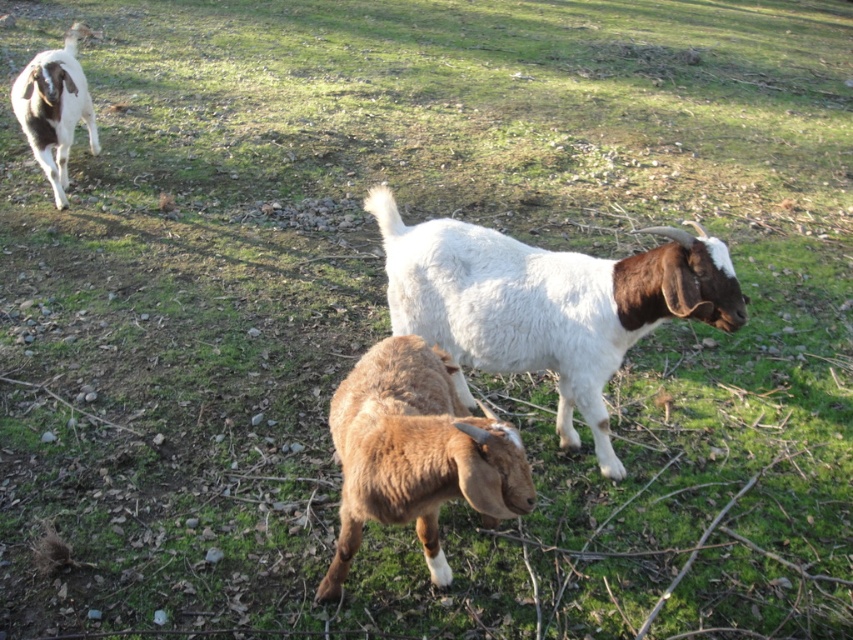
Is white woolen goat at center taller than brown fuzzy goat at center?

Correct, white woolen goat at center is much taller as brown fuzzy goat at center.

Is white woolen goat at center positioned in front of brown fuzzy goat at center?

No.

The height and width of the screenshot is (640, 853). I want to click on white woolen goat at center, so click(x=548, y=304).

Can you confirm if brown fuzzy goat at center is positioned above brown woolen goat at upper left?

No.

Between brown fuzzy goat at center and brown woolen goat at upper left, which one appears on the right side from the viewer's perspective?

Positioned to the right is brown fuzzy goat at center.

You are a GUI agent. You are given a task and a screenshot of the screen. Output one action in this format:
    pyautogui.click(x=<x>, y=<y>)
    Task: Click on the brown fuzzy goat at center
    The image size is (853, 640).
    Given the screenshot: What is the action you would take?
    pyautogui.click(x=416, y=452)

The height and width of the screenshot is (640, 853). Describe the element at coordinates (548, 304) in the screenshot. I see `white woolen goat at center` at that location.

Is white woolen goat at center taller than brown woolen goat at upper left?

No, white woolen goat at center is not taller than brown woolen goat at upper left.

The height and width of the screenshot is (640, 853). I want to click on white woolen goat at center, so click(x=548, y=304).